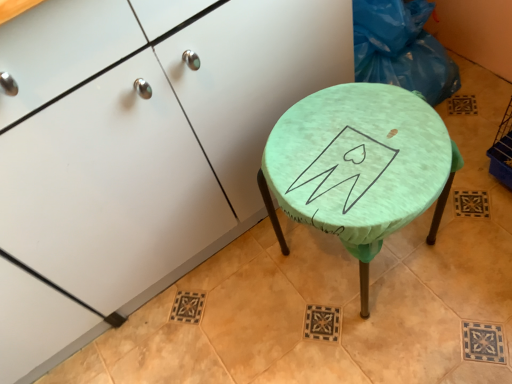
What are the coordinates of `free space below green fabric-covered stool at center (from a real-world perspective)` in the screenshot? It's located at tap(360, 263).